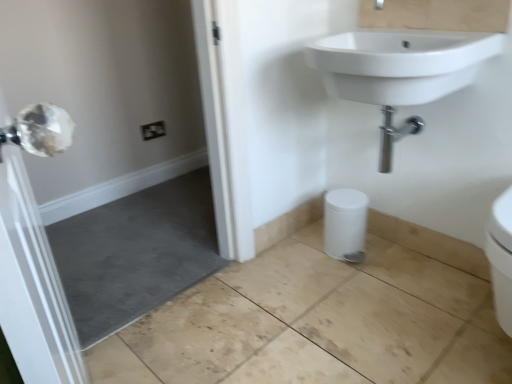
Question: Looking at the image, does white ceramic sink at upper right seem bigger or smaller compared to white matte bidet at lower center?

Choices:
 (A) small
 (B) big

Answer: (B)

Question: From the image's perspective, is white ceramic sink at upper right above or below white matte bidet at lower center?

Choices:
 (A) below
 (B) above

Answer: (B)

Question: Which object is the farthest from the white matte bidet at lower center?

Choices:
 (A) clear glass door at left
 (B) white ceramic sink at upper right

Answer: (A)

Question: Which object is the farthest from the white ceramic sink at upper right?

Choices:
 (A) clear glass door at left
 (B) white matte bidet at lower center

Answer: (A)